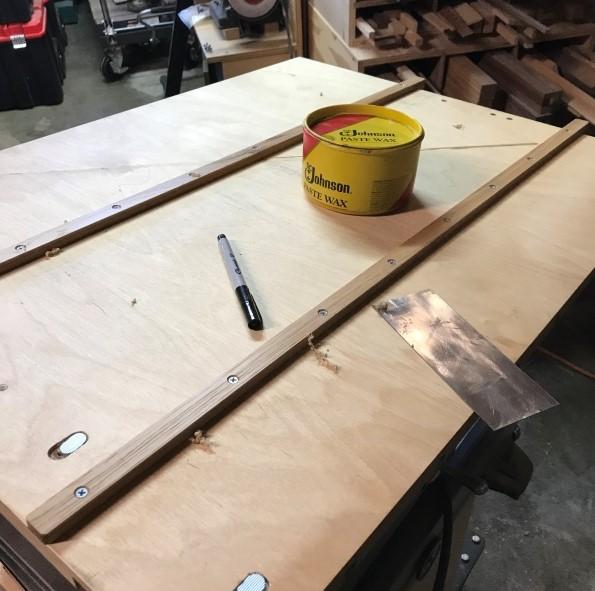
Where is `board of wood`? board of wood is located at coordinates (287, 435).